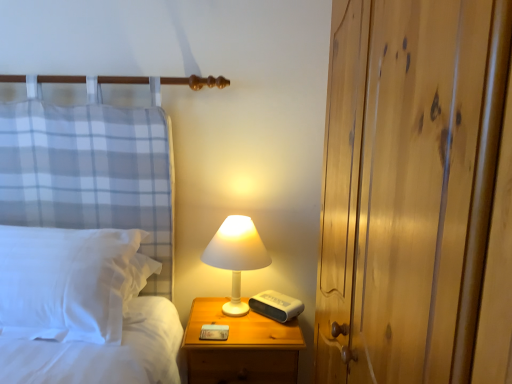
The height and width of the screenshot is (384, 512). What are the coordinates of `white matte lamp at center` in the screenshot? It's located at (236, 256).

The image size is (512, 384). Describe the element at coordinates (408, 186) in the screenshot. I see `wooden dresser at right` at that location.

Find the location of a particular element. This screenshot has height=384, width=512. white matte lamp at center is located at coordinates (236, 256).

Considering the relative sizes of white matte lamp at center and white soft pillow at left in the image provided, is white matte lamp at center shorter than white soft pillow at left?

In fact, white matte lamp at center may be taller than white soft pillow at left.

In the scene shown: Are white matte lamp at center and white soft pillow at left beside each other?

No, white matte lamp at center is not making contact with white soft pillow at left.

Looking at this image, which object is positioned more to the left, wooden nightstand at lower right or wooden dresser at right?

wooden nightstand at lower right is more to the left.

Considering the relative sizes of wooden nightstand at lower right and wooden dresser at right in the image provided, is wooden nightstand at lower right wider than wooden dresser at right?

Yes, wooden nightstand at lower right is wider than wooden dresser at right.

Which object is closer to the camera, wooden nightstand at lower right or wooden dresser at right?

wooden dresser at right is in front.

Is wooden dresser at right located outside white soft pillow at left?

That's correct, wooden dresser at right is outside of white soft pillow at left.

Considering the relative sizes of wooden dresser at right and white soft pillow at left in the image provided, is wooden dresser at right shorter than white soft pillow at left?

No, wooden dresser at right is not shorter than white soft pillow at left.

Consider the image. Considering the sizes of wooden dresser at right and white soft pillow at left in the image, is wooden dresser at right bigger or smaller than white soft pillow at left?

Clearly, wooden dresser at right is larger in size than white soft pillow at left.

In the image, there is a white soft pillow at left. Where is `nightstand below it (from a real-world perspective)`? Image resolution: width=512 pixels, height=384 pixels. nightstand below it (from a real-world perspective) is located at coordinates (241, 347).

Based on the photo, can you confirm if white soft pillow at left is shorter than wooden nightstand at lower right?

Yes, white soft pillow at left is shorter than wooden nightstand at lower right.

Considering the sizes of white soft pillow at left and wooden nightstand at lower right in the image, is white soft pillow at left wider or thinner than wooden nightstand at lower right?

In the image, white soft pillow at left appears to be more narrow than wooden nightstand at lower right.

From the image's perspective, is white soft pillow at left positioned above or below wooden nightstand at lower right?

Clearly, from the image's perspective, white soft pillow at left is above wooden nightstand at lower right.

Where is `bed that is on the left side of wooden dresser at right`? bed that is on the left side of wooden dresser at right is located at coordinates (80, 310).

Does white soft pillow at left touch wooden dresser at right?

No, white soft pillow at left is not beside wooden dresser at right.

Can you tell me how much white soft pillow at left and wooden dresser at right differ in facing direction?

There is a 89.7-degree angle between the facing directions of white soft pillow at left and wooden dresser at right.

From the image's perspective, does white soft pillow at left appear higher than wooden dresser at right?

Incorrect, from the image's perspective, white soft pillow at left is lower than wooden dresser at right.

Can you confirm if white matte lamp at center is positioned to the left of wooden dresser at right?

Yes, white matte lamp at center is to the left of wooden dresser at right.

Is white matte lamp at center not close to wooden dresser at right?

No, there isn't a large distance between white matte lamp at center and wooden dresser at right.

Where is `lamp below the wooden dresser at right (from the image's perspective)`? The width and height of the screenshot is (512, 384). lamp below the wooden dresser at right (from the image's perspective) is located at coordinates (236, 256).

From the image's perspective, which one is positioned higher, white matte lamp at center or wooden dresser at right?

wooden dresser at right, from the image's perspective.

Is wooden nightstand at lower right completely or partially inside wooden dresser at right?

No, wooden nightstand at lower right is not a part of wooden dresser at right.

From the image's perspective, who appears lower, wooden dresser at right or wooden nightstand at lower right?

wooden nightstand at lower right.

Consider the image. Is there a large distance between wooden dresser at right and wooden nightstand at lower right?

wooden dresser at right is actually quite close to wooden nightstand at lower right.

How many degrees apart are the facing directions of wooden dresser at right and wooden nightstand at lower right?

wooden dresser at right and wooden nightstand at lower right are facing 92 degrees away from each other.

Where is `lamp below the white soft pillow at left (from a real-world perspective)`? The width and height of the screenshot is (512, 384). lamp below the white soft pillow at left (from a real-world perspective) is located at coordinates (236, 256).

I want to click on dresser above the wooden nightstand at lower right (from the image's perspective), so click(408, 186).

Which object lies further to the anchor point wooden nightstand at lower right, white soft pillow at left or white matte lamp at center?

white soft pillow at left.

Looking at the image, which one is located further to white soft pillow at left, wooden nightstand at lower right or white matte lamp at center?

white matte lamp at center.

Based on their spatial positions, is white matte lamp at center or white soft pillow at left closer to wooden nightstand at lower right?

white matte lamp at center lies closer to wooden nightstand at lower right than the other object.

From the image, which object appears to be nearer to white soft pillow at left, wooden dresser at right or wooden nightstand at lower right?

The object closer to white soft pillow at left is wooden nightstand at lower right.

Looking at the image, which one is located closer to white soft pillow at left, white matte lamp at center or wooden dresser at right?

white matte lamp at center.

Based on their spatial positions, is wooden dresser at right or wooden nightstand at lower right further from white matte lamp at center?

Among the two, wooden dresser at right is located further to white matte lamp at center.

Estimate the real-world distances between objects in this image. Which object is closer to wooden dresser at right, wooden nightstand at lower right or white soft pillow at left?

Among the two, wooden nightstand at lower right is located nearer to wooden dresser at right.

When comparing their distances from white matte lamp at center, does wooden nightstand at lower right or white soft pillow at left seem closer?

wooden nightstand at lower right is positioned closer to the anchor white matte lamp at center.

Locate an element on the screen. This screenshot has height=384, width=512. nightstand between white soft pillow at left and wooden dresser at right from left to right is located at coordinates (241, 347).

Find the location of a particular element. nightstand between wooden dresser at right and white matte lamp at center along the z-axis is located at coordinates (241, 347).

Find the location of a particular element. Image resolution: width=512 pixels, height=384 pixels. lamp between white soft pillow at left and wooden nightstand at lower right is located at coordinates (236, 256).

Locate an element on the screen. The image size is (512, 384). bed positioned between wooden dresser at right and white matte lamp at center from near to far is located at coordinates pyautogui.click(x=80, y=310).